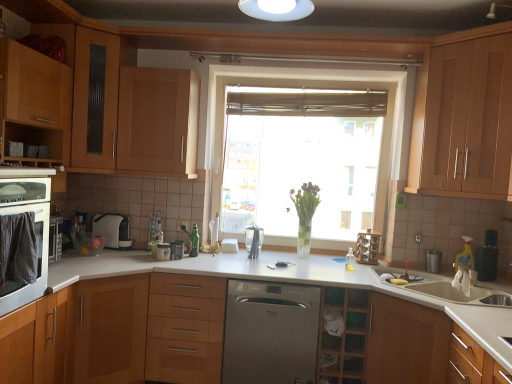
Where is `free space in front of metallic silver toaster at center, the 2th appliance in the left-to-right sequence`? free space in front of metallic silver toaster at center, the 2th appliance in the left-to-right sequence is located at coordinates (176, 264).